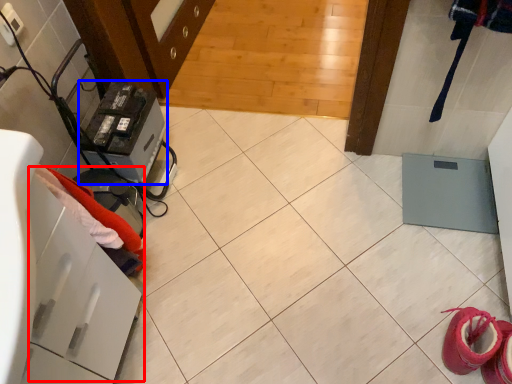
Question: Among these objects, which one is nearest to the camera, drawer (highlighted by a red box) or appliance (highlighted by a blue box)?

Choices:
 (A) drawer
 (B) appliance

Answer: (A)